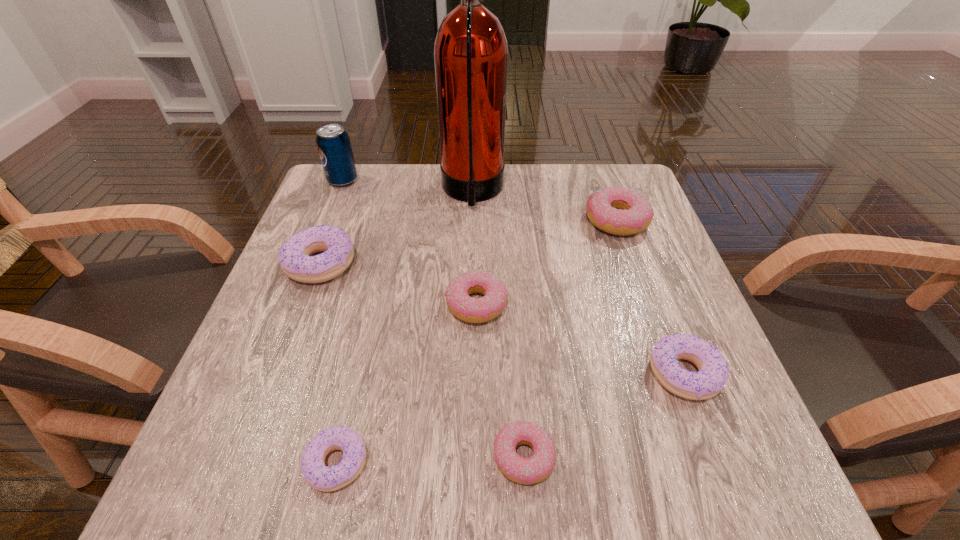
Select which purple doughnut appears as the second closest to the fire extinguisher. Please provide its 2D coordinates. Your answer should be formatted as a tuple, i.e. [(x, y)], where the tuple contains the x and y coordinates of a point satisfying the conditions above.

[(713, 373)]

In order to click on purple doughnut that can be found as the second closest to the second nearest pink doughnut in this screenshot , I will do click(x=320, y=477).

Identify the location of vacant position in the image that satisfies the following two spatial constraints: 1. on the front-facing side of the nearest pink doughnut; 2. on the right side of the red fire extinguisher. Image resolution: width=960 pixels, height=540 pixels. (468, 457).

What are the coordinates of `vacant space that satisfies the following two spatial constraints: 1. on the back side of the nearest purple doughnut; 2. on the left side of the second smallest pink doughnut` in the screenshot? It's located at (373, 304).

At what (x,y) coordinates should I click in order to perform the action: click on vacant space that satisfies the following two spatial constraints: 1. on the front side of the leftmost doughnut; 2. on the left side of the second tallest object. Please return your answer as a coordinate pair (x, y). The height and width of the screenshot is (540, 960). Looking at the image, I should click on (310, 264).

Identify the location of vacant area that satisfies the following two spatial constraints: 1. on the front-facing side of the tallest object; 2. on the left side of the second smallest purple doughnut. click(x=468, y=374).

Find the location of a particular element. This screenshot has width=960, height=540. vacant area in the image that satisfies the following two spatial constraints: 1. on the front-facing side of the fire extinguisher; 2. on the left side of the second nearest pink doughnut is located at coordinates (470, 304).